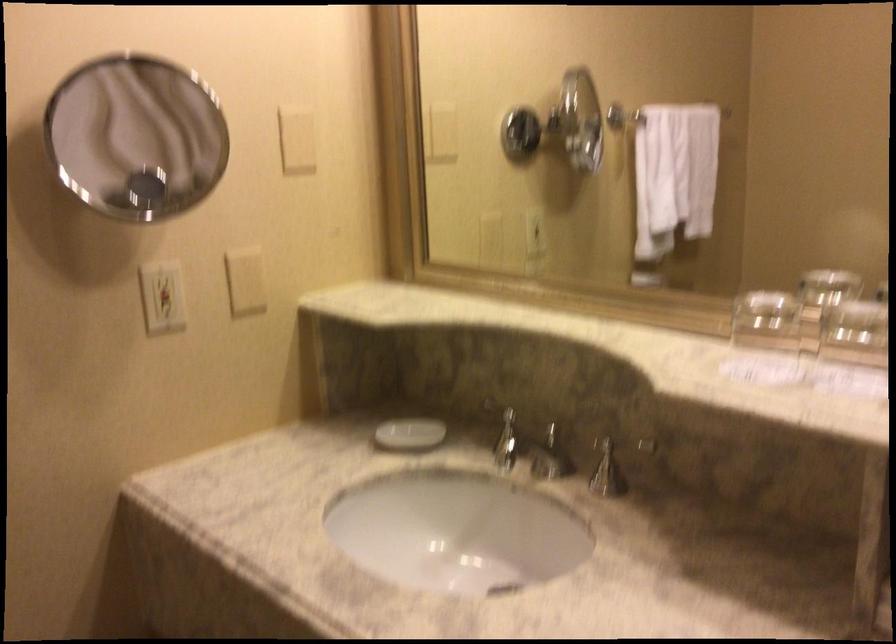
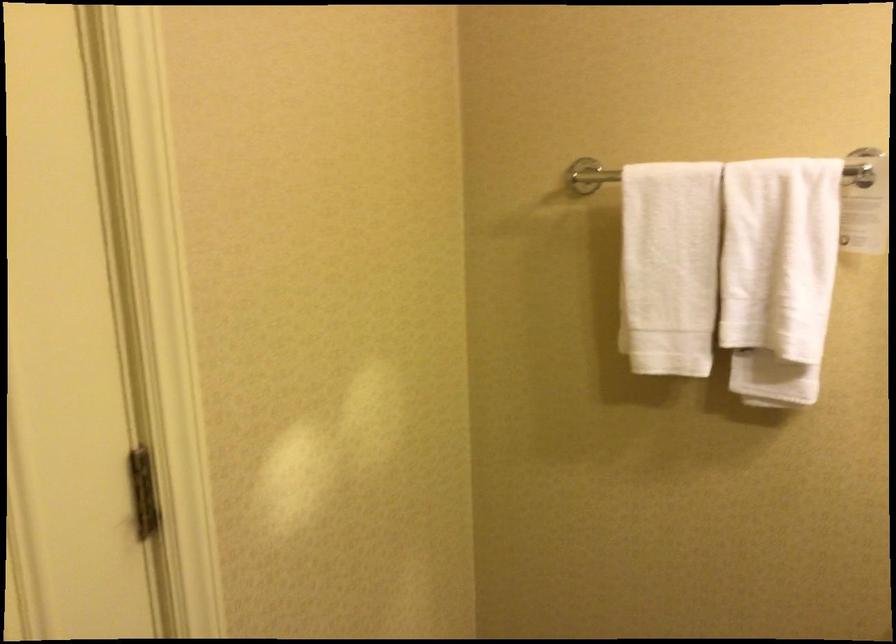
Question: How did the camera likely rotate?

Choices:
 (A) Left
 (B) Right
 (C) Up
 (D) Down

Answer: (A)